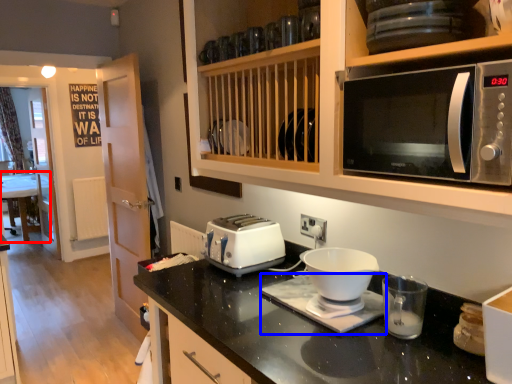
Question: Which of the following is the closest to the observer, table (highlighted by a red box) or appliance (highlighted by a blue box)?

Choices:
 (A) table
 (B) appliance

Answer: (B)